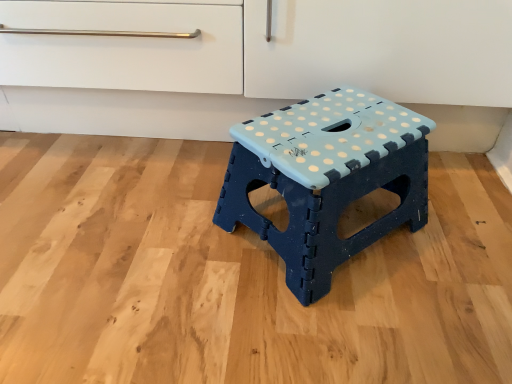
This screenshot has width=512, height=384. What do you see at coordinates (326, 178) in the screenshot?
I see `blue textured stool at center` at bounding box center [326, 178].

Where is `blue textured stool at center`? This screenshot has width=512, height=384. blue textured stool at center is located at coordinates (326, 178).

Locate an element on the screen. This screenshot has height=384, width=512. blue textured stool at center is located at coordinates (326, 178).